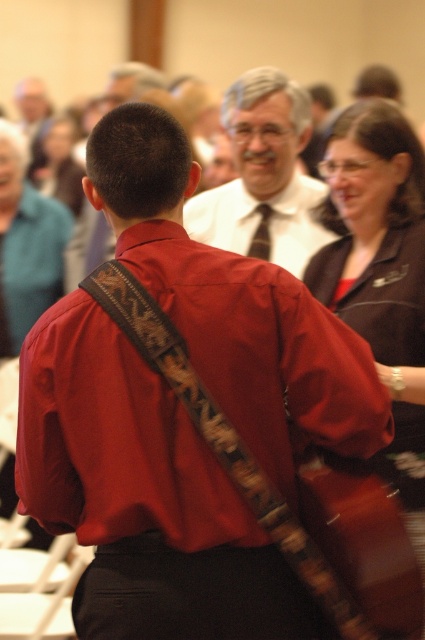
You are at a formal event and notice two attendees wearing matte black shirt at upper right and matte white shirt at center. Which attendee is taller?

The matte black shirt at upper right is taller than the matte white shirt at center.

You are standing at the point labeled point [8,232] and want to move to the point labeled point [257,252]. Given that the path between them is clear, will you be moving forward or backward relative to your current position?

Since point [8,232] is behind point [257,252], moving from point [8,232] to point [257,252] would require moving forward relative to your current position.